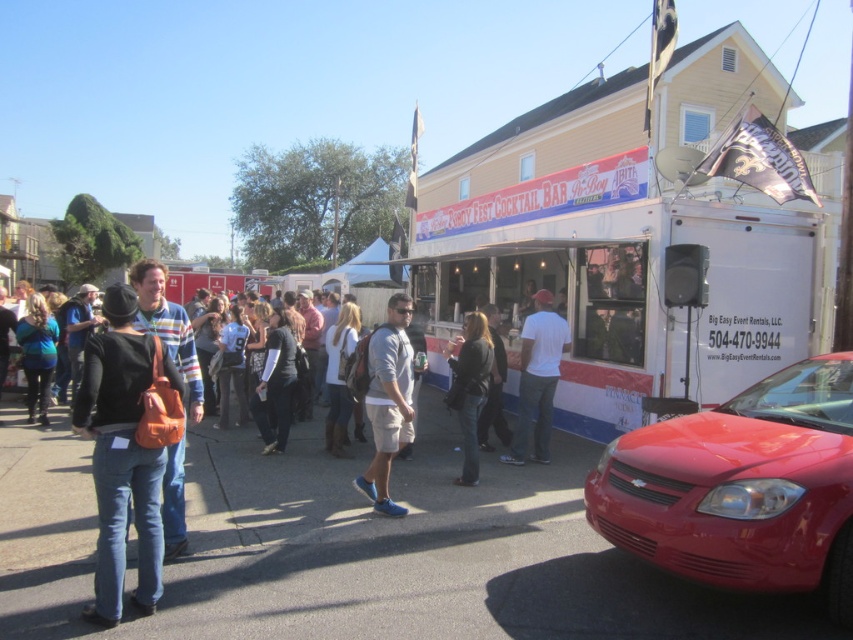
Is white/red/blue painted trailer at center below denim jeans at center?

No.

Can you confirm if white/red/blue painted trailer at center is shorter than denim jeans at center?

Incorrect, white/red/blue painted trailer at center's height does not fall short of denim jeans at center's.

The height and width of the screenshot is (640, 853). What are the coordinates of `white/red/blue painted trailer at center` in the screenshot? It's located at (631, 285).

Find the location of a particular element. white/red/blue painted trailer at center is located at coordinates (631, 285).

Can you confirm if dark gray sweater at center is positioned to the right of dark gray fabric jacket at center?

No, dark gray sweater at center is not to the right of dark gray fabric jacket at center.

Is the position of dark gray sweater at center less distant than that of dark gray fabric jacket at center?

Yes, dark gray sweater at center is closer to the viewer.

Identify the location of dark gray sweater at center. (469, 388).

Which of these two, shiny red sedan at lower right or denim jacket at lower left, stands shorter?

denim jacket at lower left is shorter.

Looking at this image, which of these two, shiny red sedan at lower right or denim jacket at lower left, stands taller?

Standing taller between the two is shiny red sedan at lower right.

The height and width of the screenshot is (640, 853). What do you see at coordinates (741, 486) in the screenshot? I see `shiny red sedan at lower right` at bounding box center [741, 486].

At what (x,y) coordinates should I click in order to perform the action: click on shiny red sedan at lower right. Please return your answer as a coordinate pair (x, y). This screenshot has width=853, height=640. Looking at the image, I should click on (741, 486).